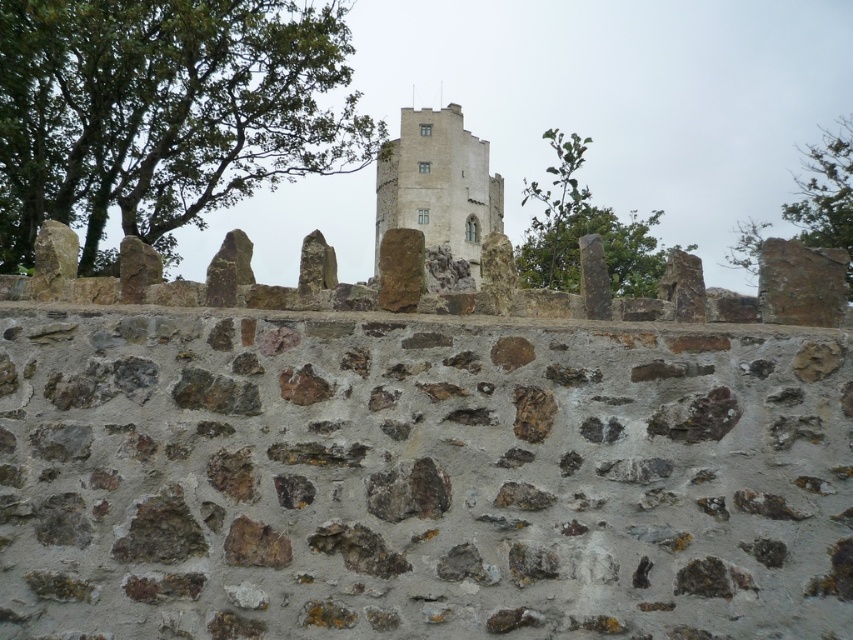
You are an archer positioned behind the medieval stone wall in the scene. You notice two green leafy trees in the distance. Which tree, the green leafy tree at upper left or the green leafy tree at upper center, would be a better target for aiming an arrow if you want to hit a larger target?

The green leafy tree at upper center is larger than the green leafy tree at upper left, so it would be a better target for aiming an arrow if you want to hit a larger target.

You are standing in front of the medieval stone wall and notice a green leafy tree at upper left. Based on its coordinates, is the tree closer to the top or the left edge of the image?

The green leafy tree at upper left is located at point coordinates approximately 0.177 on the x axis and 0.193 on the y axis. Since both values are less than 0.5, it is closer to both the top and the left edge. However, since the x coordinate is slightly smaller than the y coordinate, it is marginally closer to the left edge than the top edge.